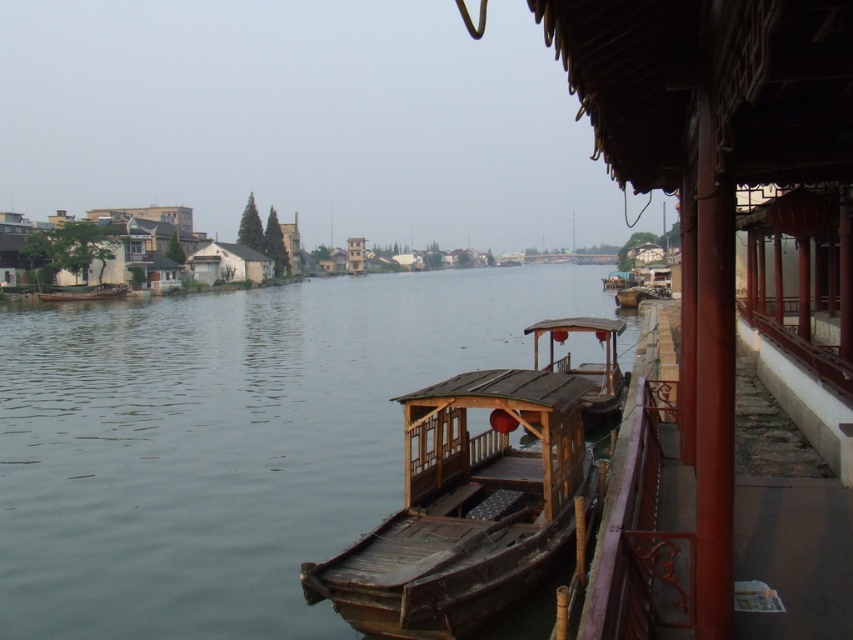
Question: Where is brown wooden boat at center located in relation to white matte hut at center in the image?

Choices:
 (A) left
 (B) right

Answer: (B)

Question: Is wooden boat at right to the left of wooden boat at center from the viewer's perspective?

Choices:
 (A) no
 (B) yes

Answer: (A)

Question: Estimate the real-world distances between objects in this image. Which object is closer to the white matte hut at center?

Choices:
 (A) brown wooden boat at center
 (B) wooden boat at center

Answer: (B)

Question: Which point is closer to the camera?

Choices:
 (A) wooden boat at center
 (B) brown wooden boat at center
 (C) white matte hut at center

Answer: (B)

Question: Is white matte hut at center smaller than wooden boat at center?

Choices:
 (A) yes
 (B) no

Answer: (B)

Question: Which point is farther from the camera taking this photo?

Choices:
 (A) click(x=102, y=288)
 (B) click(x=389, y=528)
 (C) click(x=305, y=397)
 (D) click(x=198, y=282)

Answer: (D)